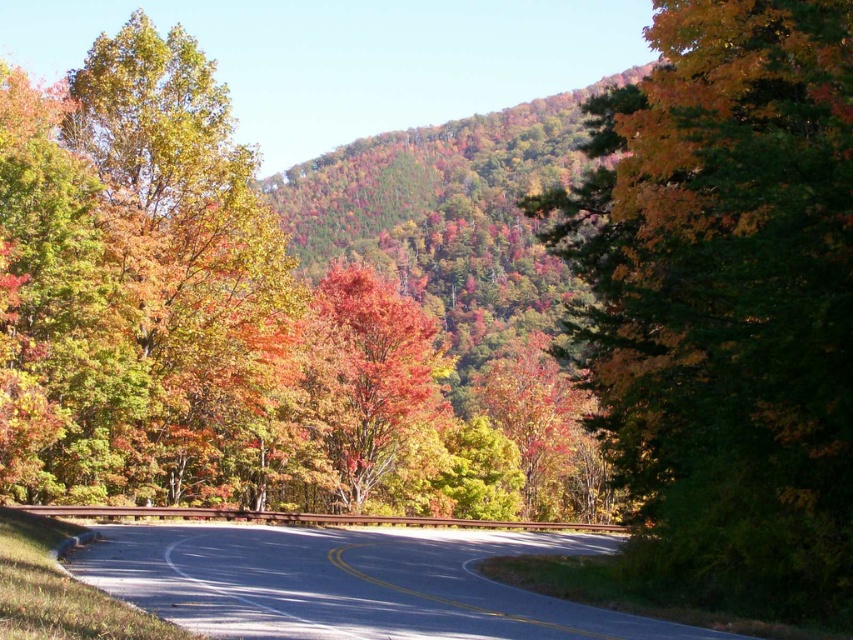
Describe the element at coordinates (724, 291) in the screenshot. This screenshot has height=640, width=853. I see `green matte tree at right` at that location.

Who is more forward, (775, 225) or (364, 484)?

Point (775, 225) is more forward.

Identify the location of green matte tree at right. (724, 291).

Between asphalt road at center and shiny red maple tree at center, which one appears on the left side from the viewer's perspective?

From the viewer's perspective, shiny red maple tree at center appears more on the left side.

Who is taller, asphalt road at center or shiny red maple tree at center?

shiny red maple tree at center is taller.

I want to click on asphalt road at center, so click(350, 582).

Does green matte tree at right have a greater height compared to asphalt road at center?

Correct, green matte tree at right is much taller as asphalt road at center.

Based on the photo, is green matte tree at right thinner than asphalt road at center?

Indeed, green matte tree at right has a lesser width compared to asphalt road at center.

Between point (833, 16) and point (456, 560), which one is positioned in front?

Positioned in front is point (833, 16).

This screenshot has width=853, height=640. In order to click on green matte tree at right in this screenshot , I will do `click(724, 291)`.